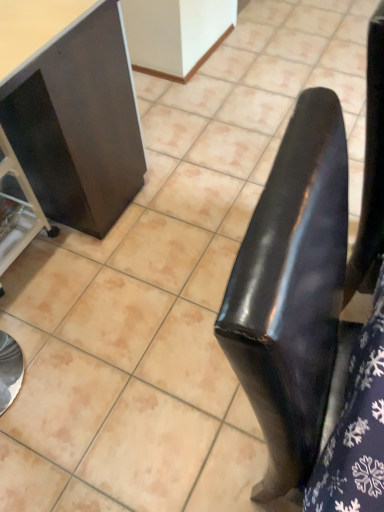
Question: Would you consider metallic silver cart at left, the 2th furniture when ordered from right to left, to be distant from matte black cabinet at left, placed as the 2th furniture when sorted from left to right?

Choices:
 (A) yes
 (B) no

Answer: (B)

Question: Would you say matte black cabinet at left, placed as the 2th furniture when sorted from left to right, is part of metallic silver cart at left, the 1th furniture positioned from the left,'s contents?

Choices:
 (A) no
 (B) yes

Answer: (A)

Question: Would you say metallic silver cart at left, the 1th furniture positioned from the left, is outside matte black cabinet at left, placed as the first furniture when sorted from right to left?

Choices:
 (A) yes
 (B) no

Answer: (B)

Question: Does metallic silver cart at left, the 1th furniture positioned from the left, appear on the right side of matte black cabinet at left, placed as the first furniture when sorted from right to left?

Choices:
 (A) yes
 (B) no

Answer: (B)

Question: Is metallic silver cart at left, the 1th furniture positioned from the left, oriented away from matte black cabinet at left, placed as the 2th furniture when sorted from left to right?

Choices:
 (A) yes
 (B) no

Answer: (A)

Question: Can you confirm if metallic silver cart at left, the 2th furniture when ordered from right to left, is shorter than matte black cabinet at left, placed as the 2th furniture when sorted from left to right?

Choices:
 (A) yes
 (B) no

Answer: (A)

Question: From the image's perspective, does matte black cabinet at left, placed as the 2th furniture when sorted from left to right, appear lower than metallic silver cart at left, the 1th furniture positioned from the left?

Choices:
 (A) no
 (B) yes

Answer: (A)

Question: Can you confirm if matte black cabinet at left, placed as the 2th furniture when sorted from left to right, is wider than metallic silver cart at left, the 2th furniture when ordered from right to left?

Choices:
 (A) no
 (B) yes

Answer: (B)

Question: Could metallic silver cart at left, the 2th furniture when ordered from right to left, be considered to be inside matte black cabinet at left, placed as the first furniture when sorted from right to left?

Choices:
 (A) yes
 (B) no

Answer: (A)

Question: From a real-world perspective, does matte black cabinet at left, placed as the 2th furniture when sorted from left to right, sit lower than metallic silver cart at left, the 2th furniture when ordered from right to left?

Choices:
 (A) yes
 (B) no

Answer: (B)

Question: Considering the relative positions of matte black cabinet at left, placed as the 2th furniture when sorted from left to right, and metallic silver cart at left, the 1th furniture positioned from the left, in the image provided, is matte black cabinet at left, placed as the 2th furniture when sorted from left to right, in front of metallic silver cart at left, the 1th furniture positioned from the left,?

Choices:
 (A) yes
 (B) no

Answer: (A)

Question: Is matte black cabinet at left, placed as the 2th furniture when sorted from left to right, taller than metallic silver cart at left, the 2th furniture when ordered from right to left?

Choices:
 (A) no
 (B) yes

Answer: (B)

Question: In the image, is matte black cabinet at left, placed as the 2th furniture when sorted from left to right, positioned in front of or behind metallic silver cart at left, the 1th furniture positioned from the left?

Choices:
 (A) front
 (B) behind

Answer: (A)